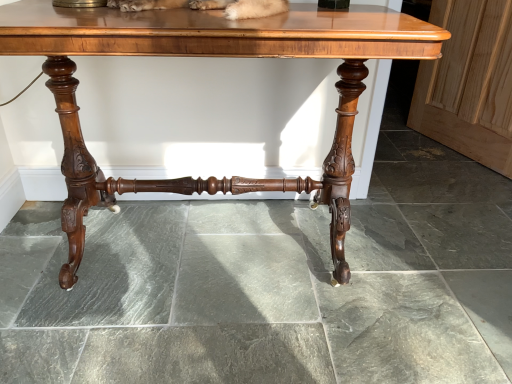
This screenshot has height=384, width=512. Describe the element at coordinates (209, 55) in the screenshot. I see `polished wood table at center` at that location.

Find the location of a particular element. The width and height of the screenshot is (512, 384). polished wood table at center is located at coordinates (209, 55).

In order to face wooden screen door at right, should I rotate leftwards or rightwards?

To face it directly, rotate right by 27.515 degrees.

What do you see at coordinates (469, 83) in the screenshot? This screenshot has height=384, width=512. I see `wooden screen door at right` at bounding box center [469, 83].

Where is `wooden screen door at right`? This screenshot has height=384, width=512. wooden screen door at right is located at coordinates (469, 83).

This screenshot has width=512, height=384. I want to click on polished wood table at center, so click(x=209, y=55).

Which object is positioned more to the right, wooden screen door at right or polished wood table at center?

wooden screen door at right is more to the right.

Is wooden screen door at right positioned behind polished wood table at center?

Yes, wooden screen door at right is further from the camera.

Between point (494, 145) and point (310, 52), which one is positioned in front?

The point (310, 52) is closer.

From the image's perspective, is wooden screen door at right above polished wood table at center?

Yes, from the image's perspective, wooden screen door at right is above polished wood table at center.

From a real-world perspective, is wooden screen door at right located beneath polished wood table at center?

Yes, from a real-world perspective, wooden screen door at right is below polished wood table at center.

Can you confirm if wooden screen door at right is thinner than polished wood table at center?

Yes.

Is wooden screen door at right shorter than polished wood table at center?

Correct, wooden screen door at right is not as tall as polished wood table at center.

Between wooden screen door at right and polished wood table at center, which one has larger size?

polished wood table at center is bigger.

Is wooden screen door at right located outside polished wood table at center?

Yes, wooden screen door at right is not within polished wood table at center.

Looking at this image, is there a large distance between wooden screen door at right and polished wood table at center?

Yes, wooden screen door at right and polished wood table at center are located far from each other.

Could you tell me if wooden screen door at right is facing polished wood table at center?

Yes, wooden screen door at right is facing polished wood table at center.

How distant is wooden screen door at right from polished wood table at center?

wooden screen door at right is 1.26 meters from polished wood table at center.

What are the coordinates of `table above the wooden screen door at right (from a real-world perspective)` in the screenshot? It's located at (209, 55).

Is polished wood table at center to the left of wooden screen door at right from the viewer's perspective?

Indeed, polished wood table at center is positioned on the left side of wooden screen door at right.

Which object is more forward, polished wood table at center or wooden screen door at right?

polished wood table at center is more forward.

Considering the positions of points (192, 21) and (499, 82), is point (192, 21) farther from camera compared to point (499, 82)?

No.

From the image's perspective, is polished wood table at center located above wooden screen door at right?

No, from the image's perspective, polished wood table at center is not on top of wooden screen door at right.

From a real-world perspective, is polished wood table at center over wooden screen door at right?

Yes, from a real-world perspective, polished wood table at center is over wooden screen door at right

Looking at their sizes, would you say polished wood table at center is wider or thinner than wooden screen door at right?

Clearly, polished wood table at center has more width compared to wooden screen door at right.

In terms of height, does polished wood table at center look taller or shorter compared to wooden screen door at right?

polished wood table at center is taller than wooden screen door at right.

Looking at the image, does polished wood table at center seem bigger or smaller compared to wooden screen door at right?

Clearly, polished wood table at center is larger in size than wooden screen door at right.

Can we say polished wood table at center lies outside wooden screen door at right?

Yes, polished wood table at center is not within wooden screen door at right.

Does polished wood table at center touch wooden screen door at right?

polished wood table at center and wooden screen door at right are clearly separated.

In the scene shown: Could you tell me if polished wood table at center is facing wooden screen door at right?

No, polished wood table at center is not turned towards wooden screen door at right.

What's the angular difference between polished wood table at center and wooden screen door at right's facing directions?

There is a 71.2-degree angle between the facing directions of polished wood table at center and wooden screen door at right.

How distant is polished wood table at center from wooden screen door at right?

The distance of polished wood table at center from wooden screen door at right is 4.15 feet.

Identify the location of table positioned vertically above the wooden screen door at right (from a real-world perspective). (209, 55).

Where is `table that appears on the left of wooden screen door at right`? Image resolution: width=512 pixels, height=384 pixels. table that appears on the left of wooden screen door at right is located at coordinates (209, 55).

In the image, there is a wooden screen door at right. Identify the location of table below it (from the image's perspective). This screenshot has width=512, height=384. (209, 55).